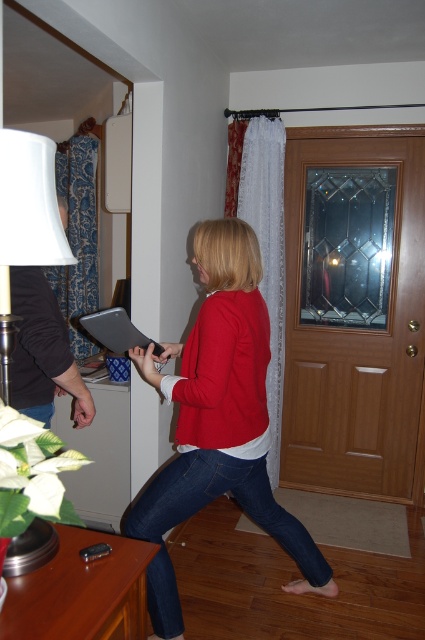
Describe the element at coordinates (218, 420) in the screenshot. Image resolution: width=425 pixels, height=640 pixels. I see `matte red sweater at center` at that location.

Who is taller, matte red sweater at center or matte black clipboard at center?

matte red sweater at center is taller.

Who is more forward, (235, 310) or (82, 316)?

Point (235, 310) is more forward.

Where is `matte red sweater at center`? This screenshot has width=425, height=640. matte red sweater at center is located at coordinates (218, 420).

Is point (164, 636) positioned after point (20, 131)?

Yes, it is.

In the scene shown: Which is more to the left, matte red sweater at center or white fabric lampshade at left?

Positioned to the left is white fabric lampshade at left.

The width and height of the screenshot is (425, 640). What are the coordinates of `matte red sweater at center` in the screenshot? It's located at (218, 420).

Can you confirm if white fabric lampshade at left is positioned above matte black clipboard at center?

Indeed, white fabric lampshade at left is positioned over matte black clipboard at center.

Measure the distance between point (14, 253) and camera.

The distance of point (14, 253) from camera is 3.43 feet.

In order to click on white fabric lampshade at left in this screenshot , I will do `click(28, 208)`.